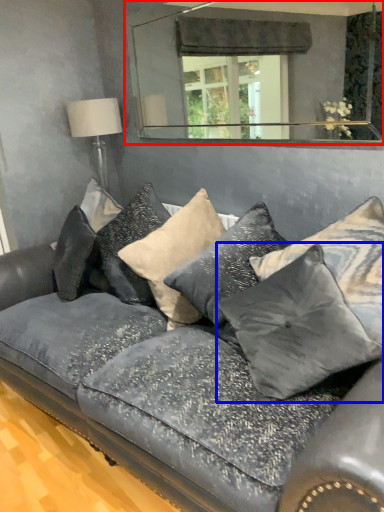
Question: Which object is further to the camera taking this photo, mirror (highlighted by a red box) or pillow (highlighted by a blue box)?

Choices:
 (A) mirror
 (B) pillow

Answer: (A)